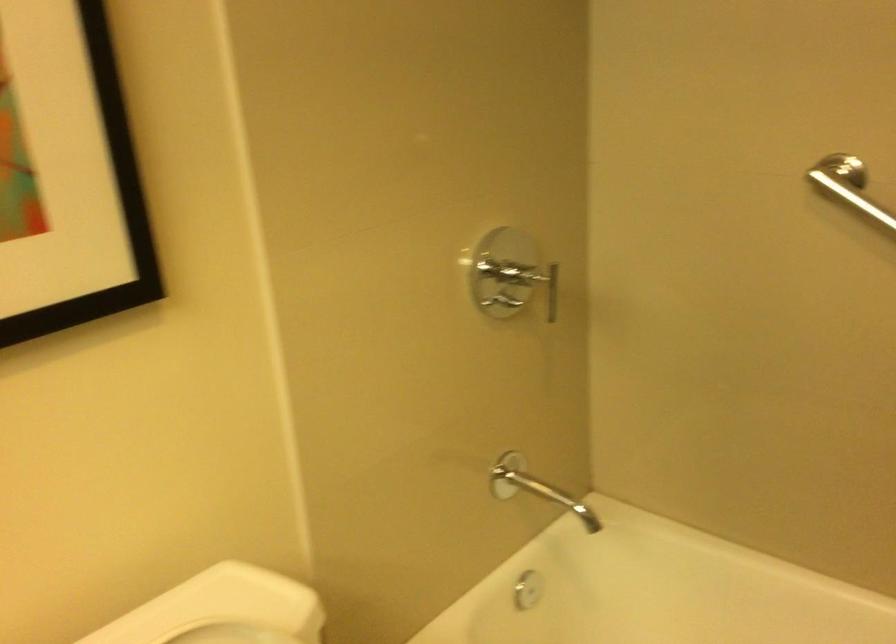
Describe the element at coordinates (849, 187) in the screenshot. I see `the metal grab bar` at that location.